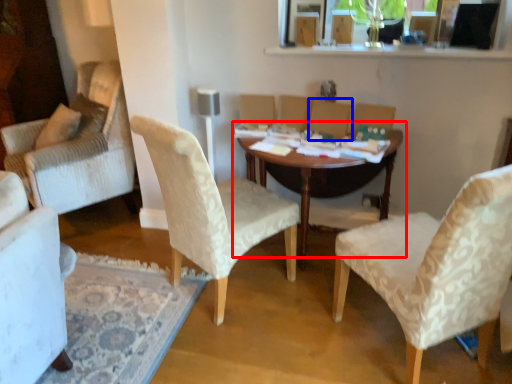
Question: Which object appears farthest to the camera in this image, table (highlighted by a red box) or armchair (highlighted by a blue box)?

Choices:
 (A) table
 (B) armchair

Answer: (B)